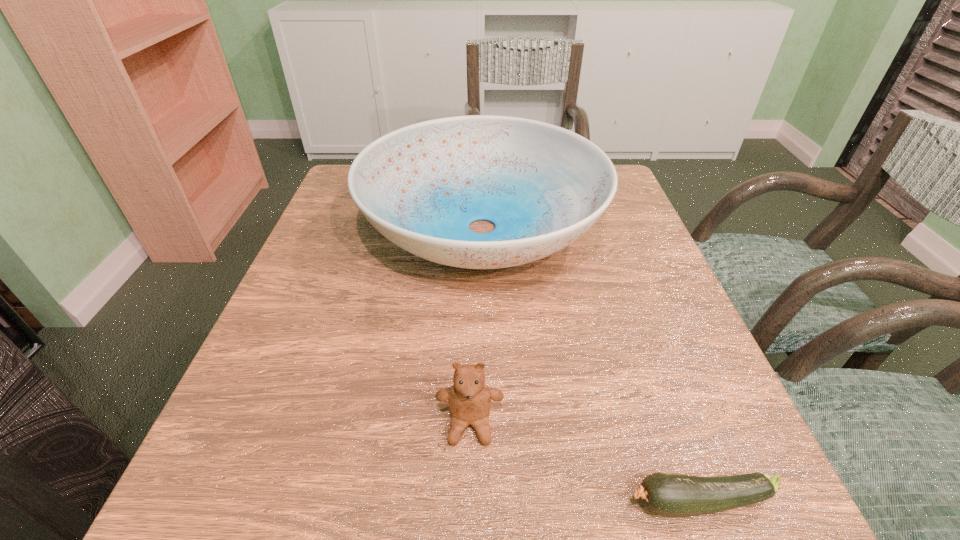
The width and height of the screenshot is (960, 540). Identify the location of the tallest object. [421, 186].

Where is `dish`? dish is located at coordinates (421, 186).

Where is `teddy bear`? The image size is (960, 540). teddy bear is located at coordinates (469, 399).

Where is `the second tallest object`? the second tallest object is located at coordinates [469, 399].

The height and width of the screenshot is (540, 960). What are the coordinates of `the shortest object` in the screenshot? It's located at (673, 495).

The width and height of the screenshot is (960, 540). What are the coordinates of `zucchini` in the screenshot? It's located at (673, 495).

Where is `vacant space located 0.300m on the front of the dish`? This screenshot has width=960, height=540. vacant space located 0.300m on the front of the dish is located at coordinates tap(484, 475).

Locate an element on the screen. The height and width of the screenshot is (540, 960). vacant space located 0.060m on the face of the second farthest object is located at coordinates (468, 492).

Find the location of a particular element. The width and height of the screenshot is (960, 540). free location located 0.120m at the blossom end of the nearest object is located at coordinates (531, 502).

The image size is (960, 540). I want to click on free location located at the blossom end of the nearest object, so click(444, 502).